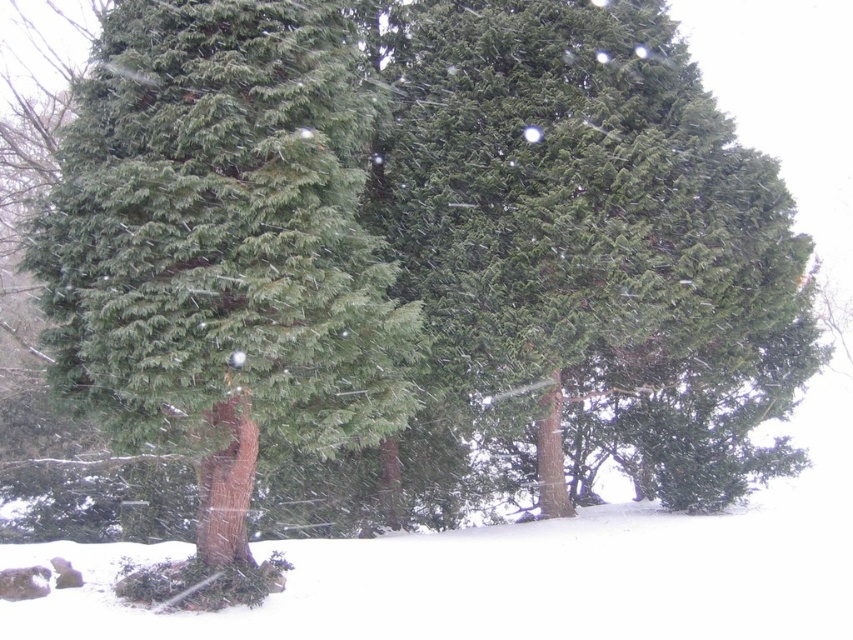
Question: Observing the image, what is the correct spatial positioning of green needle-like at center in reference to green matte fir tree at center?

Choices:
 (A) left
 (B) right

Answer: (B)

Question: Is green needle-like at center above green matte fir tree at center?

Choices:
 (A) no
 (B) yes

Answer: (B)

Question: Is green needle-like at center thinner than green matte fir tree at center?

Choices:
 (A) no
 (B) yes

Answer: (A)